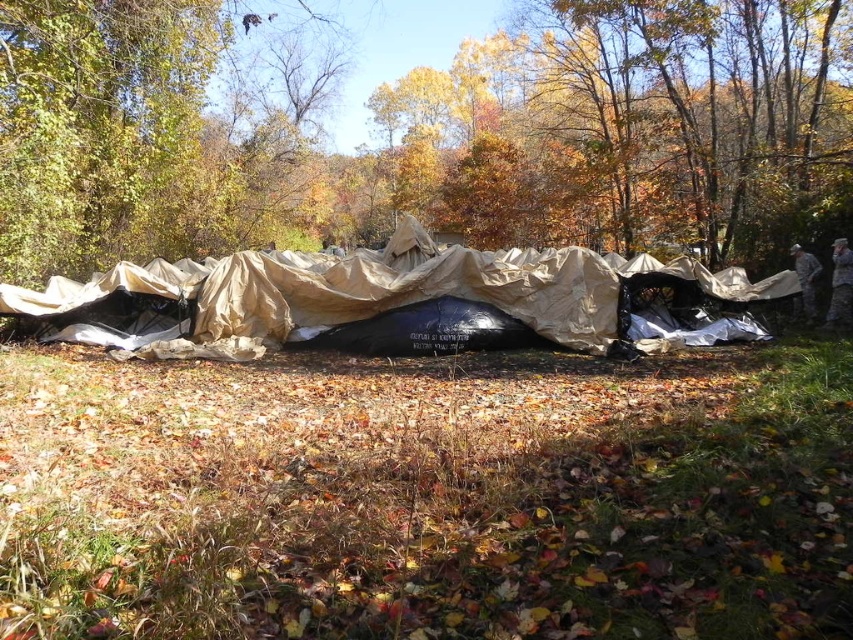
Does brown matte tarp at center come in front of tan fabric tent at center?

No, it is behind tan fabric tent at center.

Does brown matte tarp at center have a greater height compared to tan fabric tent at center?

Indeed, brown matte tarp at center has a greater height compared to tan fabric tent at center.

At what (x,y) coordinates should I click in order to perform the action: click on brown matte tarp at center. Please return your answer as a coordinate pair (x, y). The height and width of the screenshot is (640, 853). Looking at the image, I should click on (456, 141).